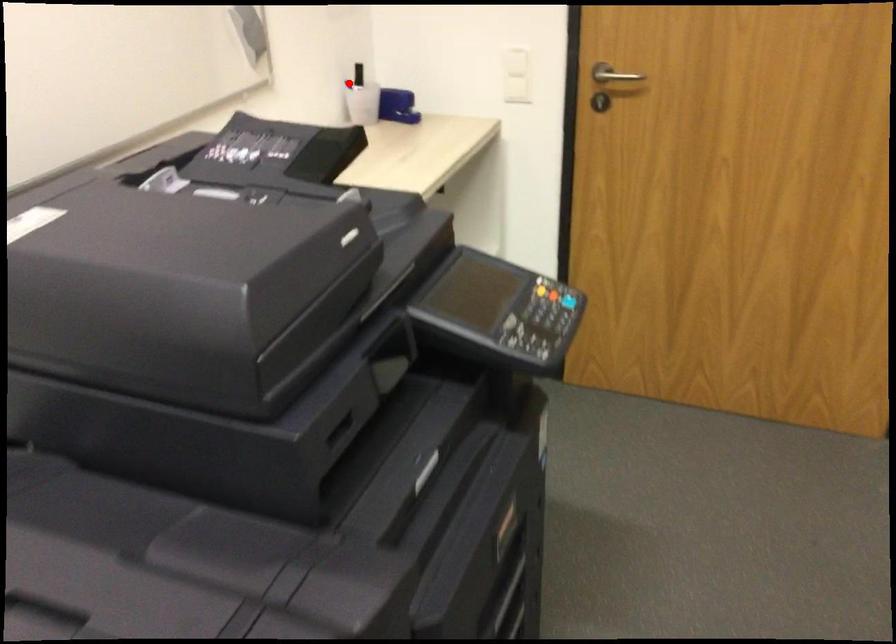
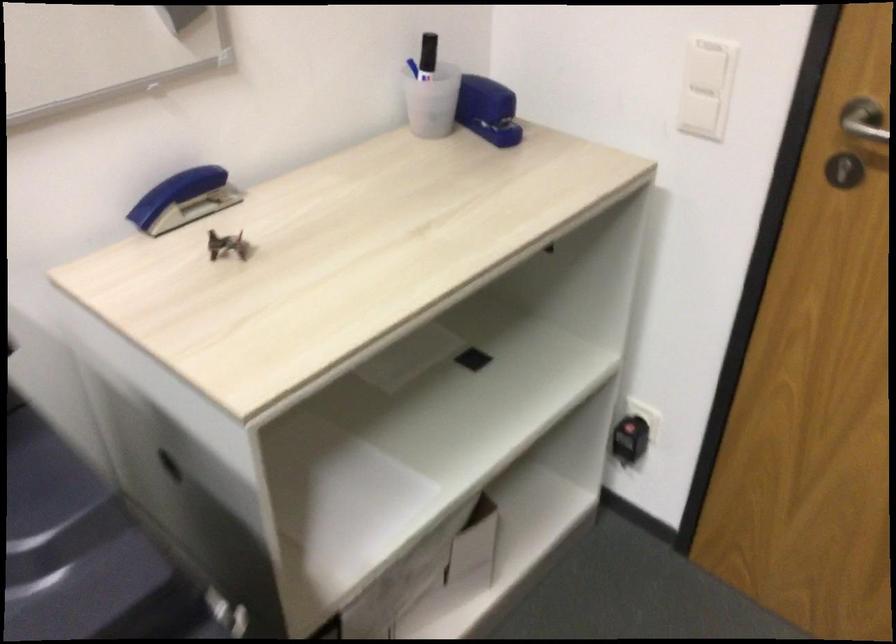
Locate, in the second image, the point that corresponds to the highlighted location in the first image.

(412, 67)